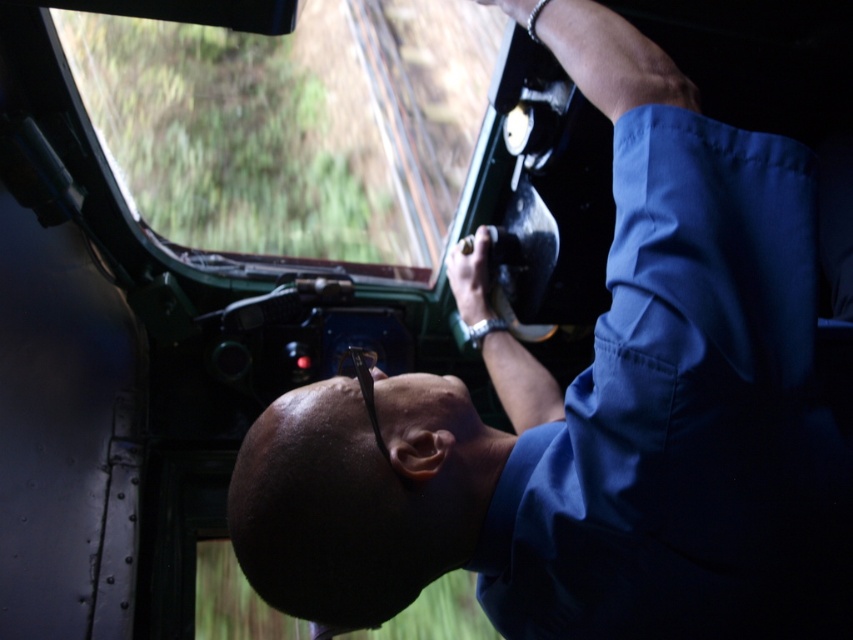
Question: Is blue fabric shirt at center further to camera compared to black matte head at center?

Choices:
 (A) yes
 (B) no

Answer: (B)

Question: Estimate the real-world distances between objects in this image. Which object is closer to the metallic silver train track at upper center?

Choices:
 (A) black matte head at center
 (B) blue fabric shirt at center

Answer: (A)

Question: Which point is closer to the camera taking this photo?

Choices:
 (A) (654, 154)
 (B) (444, 221)
 (C) (395, 541)

Answer: (A)

Question: Among these points, which one is farthest from the camera?

Choices:
 (A) (335, 385)
 (B) (408, 161)
 (C) (364, 390)

Answer: (B)

Question: Is blue fabric shirt at center above black matte head at center?

Choices:
 (A) no
 (B) yes

Answer: (B)

Question: Does black matte head at center have a smaller size compared to metallic silver train track at upper center?

Choices:
 (A) yes
 (B) no

Answer: (A)